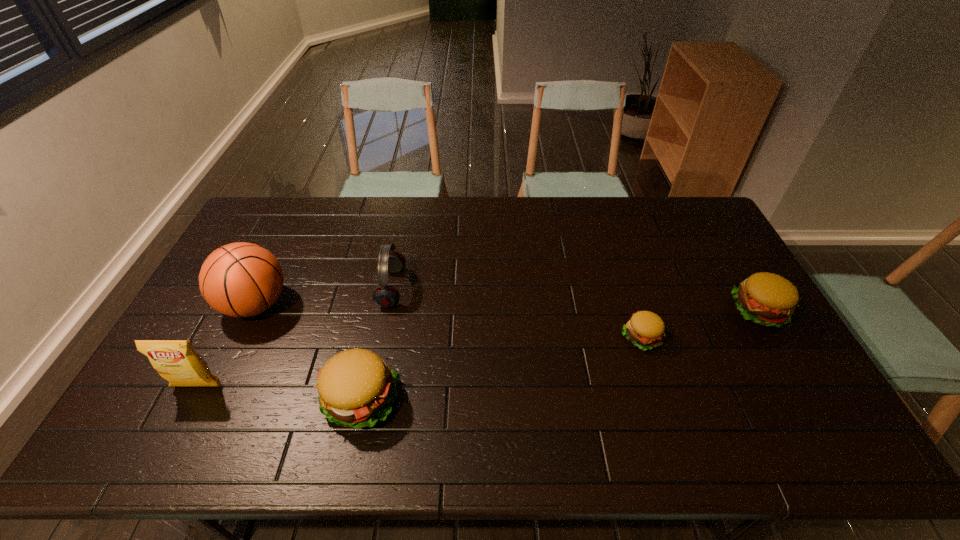
I want to click on vacant spot for a new hamburger to ensure equal spacing, so click(509, 367).